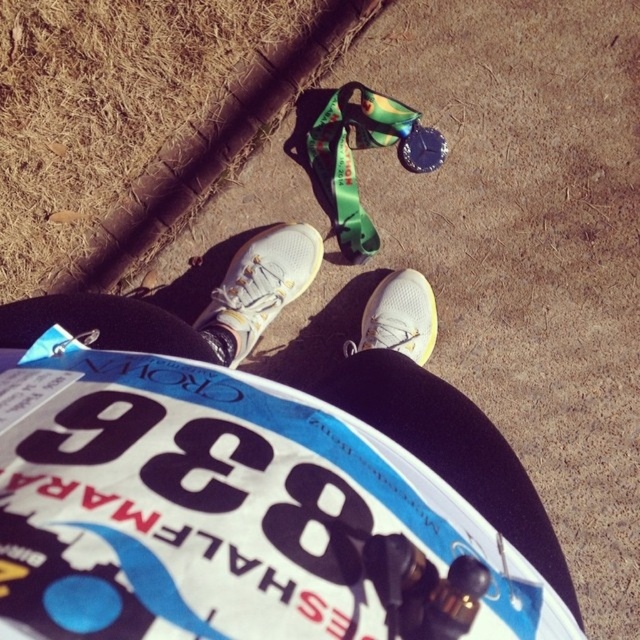
The height and width of the screenshot is (640, 640). I want to click on white fabric shoe at center, so click(259, 289).

Who is positioned more to the right, white fabric shoe at center or white mesh shoe at center?

white mesh shoe at center

Image resolution: width=640 pixels, height=640 pixels. What do you see at coordinates (259, 289) in the screenshot? I see `white fabric shoe at center` at bounding box center [259, 289].

Identify the location of white fabric shoe at center. (259, 289).